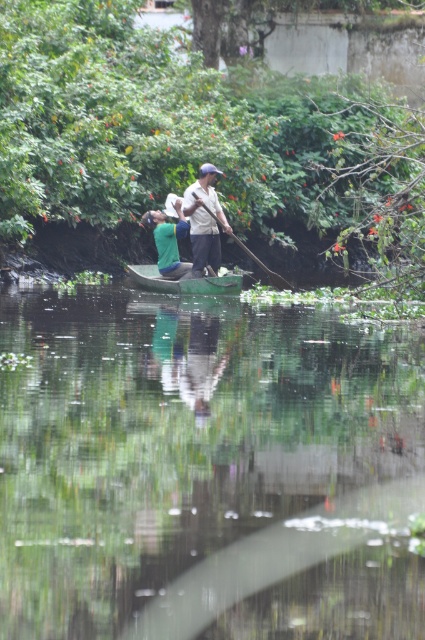
Measure the distance between green fabric shirt at center and camera.

They are 24.23 meters apart.

Is green fabric shirt at center above wooden smooth paddle at center?

Correct, green fabric shirt at center is located above wooden smooth paddle at center.

At what (x,y) coordinates should I click in order to perform the action: click on green fabric shirt at center. Please return your answer as a coordinate pair (x, y). The width and height of the screenshot is (425, 640). Looking at the image, I should click on (167, 241).

I want to click on green fabric shirt at center, so click(x=167, y=241).

Can you confirm if light brown wooden paddle at center is positioned above wooden smooth paddle at center?

Indeed, light brown wooden paddle at center is positioned over wooden smooth paddle at center.

Does light brown wooden paddle at center appear on the left side of wooden smooth paddle at center?

Correct, you'll find light brown wooden paddle at center to the left of wooden smooth paddle at center.

Is point (187, 198) closer to camera compared to point (217, 220)?

No, it is not.

I want to click on light brown wooden paddle at center, so click(204, 220).

Between point (322, 428) and point (286, 282), which one is positioned behind?

Positioned behind is point (286, 282).

The image size is (425, 640). Identify the location of green plastic boat at center. (178, 440).